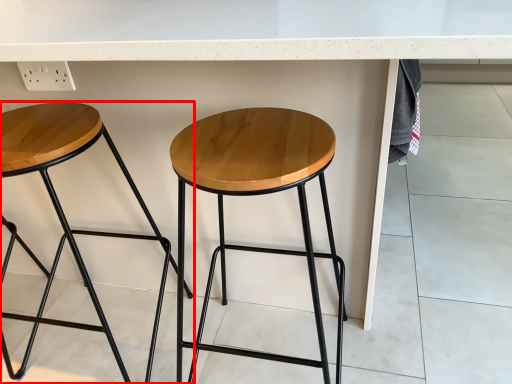
Question: Considering the relative positions of stool (annotated by the red box) and stool in the image provided, where is stool (annotated by the red box) located with respect to the staircase?

Choices:
 (A) right
 (B) left

Answer: (B)